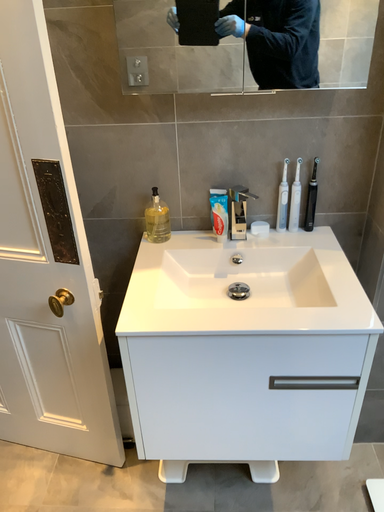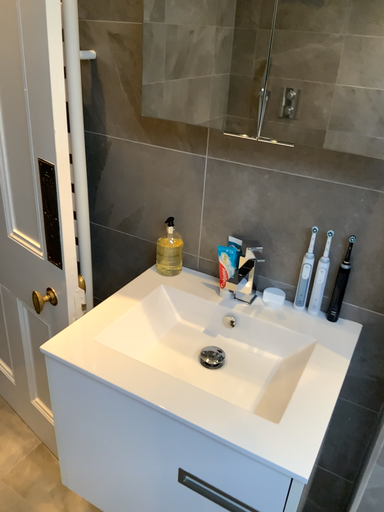
Question: How did the camera likely rotate when shooting the video?

Choices:
 (A) rotated upward
 (B) rotated downward

Answer: (A)